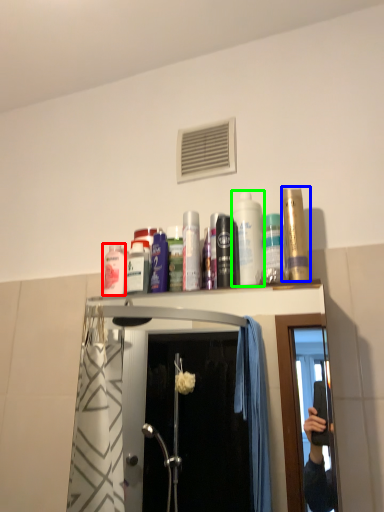
Question: Which object is positioned farthest from mouthwash (highlighted by a red box)? Select from mouthwash (highlighted by a blue box) and mouthwash (highlighted by a green box).

Choices:
 (A) mouthwash
 (B) mouthwash

Answer: (A)